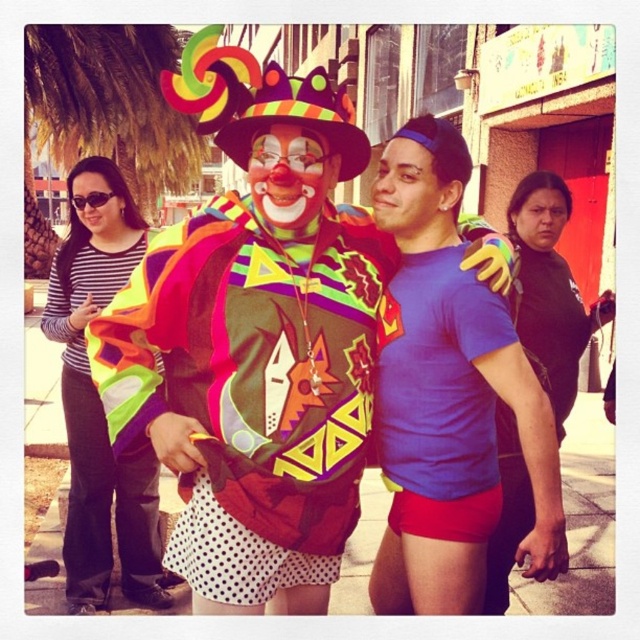
Question: Which point is farther to the camera?

Choices:
 (A) (580, 349)
 (B) (436, 369)
 (C) (257, 163)
 (D) (548, 243)

Answer: (A)

Question: Does matte black shirt at right have a lesser width compared to matte black sunglasses at upper left?

Choices:
 (A) no
 (B) yes

Answer: (A)

Question: Among these points, which one is nearest to the camera?

Choices:
 (A) tap(332, 131)
 (B) tap(524, 284)
 (C) tap(284, 214)
 (D) tap(554, 212)

Answer: (C)

Question: Estimate the real-world distances between objects in this image. Which object is closer to the matte black sunglasses at upper left?

Choices:
 (A) blue matte t-shirt at center
 (B) smooth skin face at center
 (C) matte black shirt at right

Answer: (A)

Question: From the image, what is the correct spatial relationship of matte clown face at center in relation to matte black sunglasses at upper left?

Choices:
 (A) above
 (B) below

Answer: (B)

Question: Observing the image, what is the correct spatial positioning of striped fabric shirt at left in reference to matte blue shirt at center?

Choices:
 (A) right
 (B) left

Answer: (B)